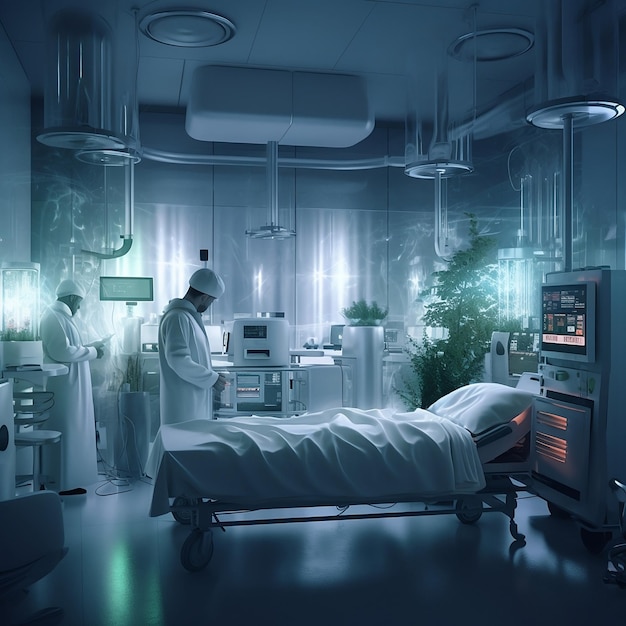
At what (x,y) coordinates should I click in order to perform the action: click on pillow. Please return your answer as a coordinate pair (x, y). Looking at the image, I should click on (473, 403).